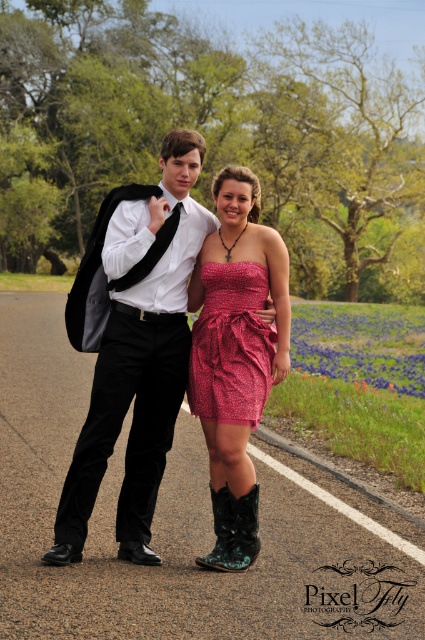
Question: Is sparkly pink dress at center closer to the viewer compared to green suede boot at lower center?

Choices:
 (A) no
 (B) yes

Answer: (B)

Question: Does sparkly red dress at center have a larger size compared to green suede boot at lower center?

Choices:
 (A) yes
 (B) no

Answer: (A)

Question: Which object is farther from the camera taking this photo?

Choices:
 (A) black satin tie at center
 (B) sparkly pink dress at center

Answer: (A)

Question: Where is shiny black suit at center located in relation to green suede boot at lower center in the image?

Choices:
 (A) above
 (B) below

Answer: (A)

Question: Which object is positioned farthest from the black satin tie at center?

Choices:
 (A) sparkly red dress at center
 (B) green suede boot at lower center
 (C) turquoise leather boot at lower center

Answer: (C)

Question: Which point appears closest to the camera in this image?

Choices:
 (A) (229, 492)
 (B) (263, 369)
 (C) (178, 216)

Answer: (B)